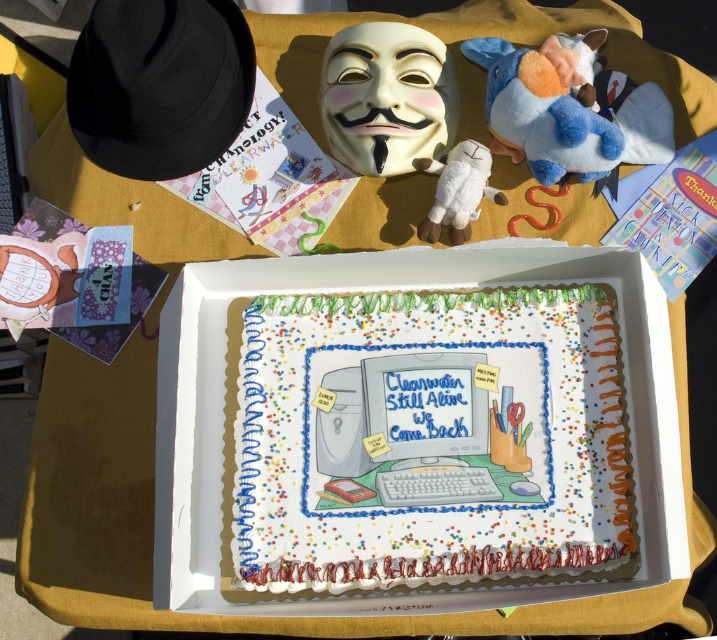
Question: Which object is the closest to the blue plush toy at upper right?

Choices:
 (A) white frosted sheet cake at center
 (B) white matte mask at upper center

Answer: (B)

Question: Which point is farther to the camera?

Choices:
 (A) (571, 61)
 (B) (379, 536)

Answer: (A)

Question: Can you confirm if white matte mask at upper center is wider than blue plush toy at upper right?

Choices:
 (A) yes
 (B) no

Answer: (B)

Question: From the image, what is the correct spatial relationship of blue plush toy at upper right in relation to white plush toy at center?

Choices:
 (A) right
 (B) left

Answer: (A)

Question: Is white matte mask at upper center to the right of white plush toy at center from the viewer's perspective?

Choices:
 (A) yes
 (B) no

Answer: (B)

Question: Considering the real-world distances, which object is farthest from the blue plush toy at upper right?

Choices:
 (A) white plush toy at center
 (B) white frosted sheet cake at center
 (C) white matte mask at upper center

Answer: (B)